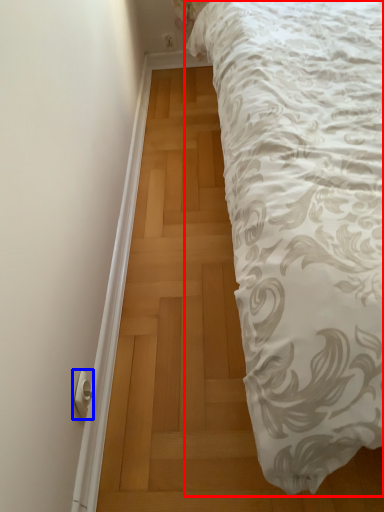
Question: Among these objects, which one is farthest to the camera, bed (highlighted by a red box) or door handle (highlighted by a blue box)?

Choices:
 (A) bed
 (B) door handle

Answer: (B)